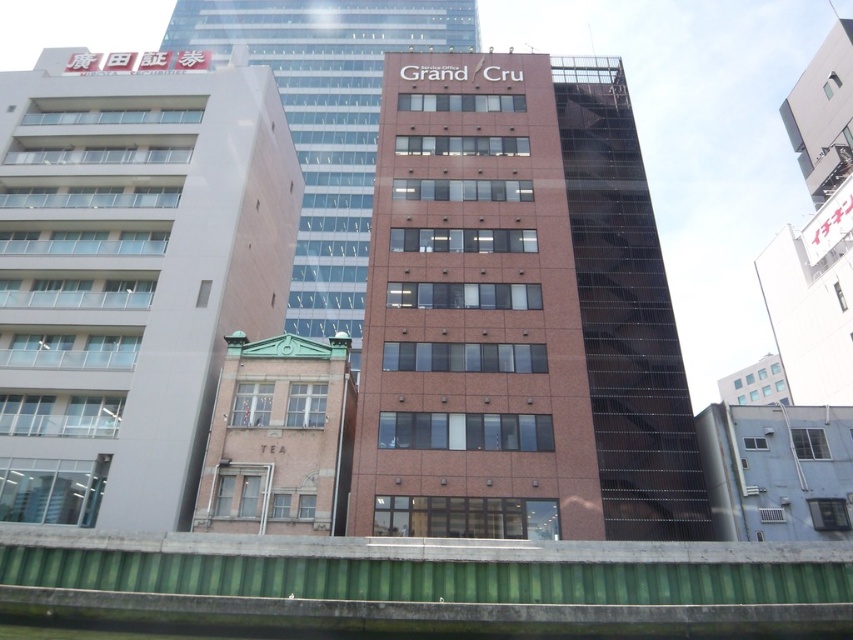
You are standing on the green metal railing in the foreground and want to walk towards the central building. Which building should you pass first, the matte brick building at left or the brown brick building at lower left?

The brown brick building at lower left is positioned below the matte brick building at left, so you would encounter the brown brick building at lower left first as you walk towards the central building.